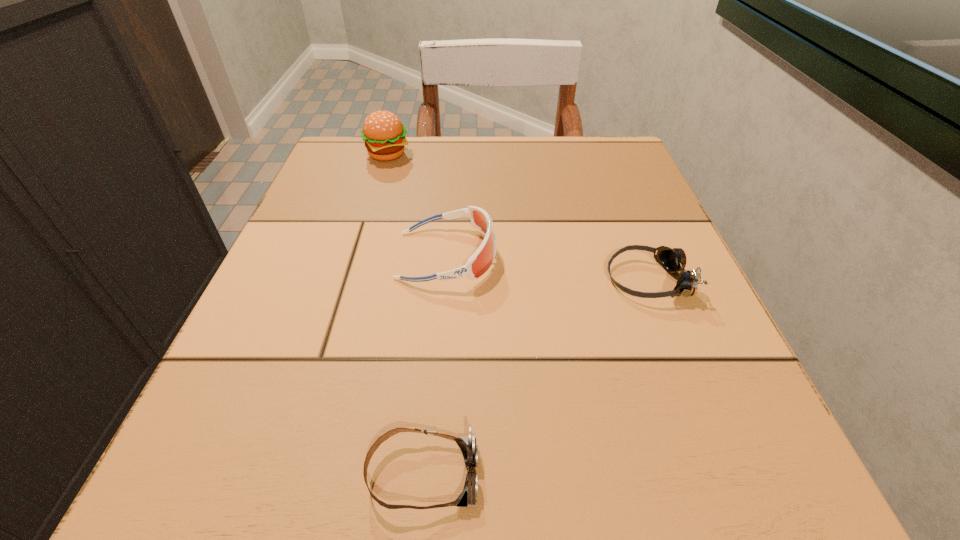
Find the location of `vacant area situated through the lenses of the third tallest object`. vacant area situated through the lenses of the third tallest object is located at coordinates (524, 280).

Find the location of `vacant space situated through the lenses of the third tallest object`. vacant space situated through the lenses of the third tallest object is located at coordinates (435, 280).

The image size is (960, 540). What are the coordinates of `vacant space located 0.220m on the front-facing side of the shortest object` in the screenshot? It's located at (682, 474).

Identify the location of object that is at the far edge. point(384,135).

Where is `object that is at the near edge`? Image resolution: width=960 pixels, height=540 pixels. object that is at the near edge is located at coordinates click(467, 445).

In order to click on object positioned at the left edge in this screenshot , I will do `click(384, 135)`.

This screenshot has width=960, height=540. I want to click on object that is at the right edge, so click(672, 260).

This screenshot has width=960, height=540. In order to click on object present at the far left corner in this screenshot , I will do `click(384, 135)`.

You are a GUI agent. You are given a task and a screenshot of the screen. Output one action in this format:
    pyautogui.click(x=<x>, y=<y>)
    Task: Click on the free space at the far edge
    Image resolution: width=960 pixels, height=540 pixels.
    Given the screenshot: What is the action you would take?
    pyautogui.click(x=401, y=186)

Locate an element on the screen. The width and height of the screenshot is (960, 540). vacant space at the left edge is located at coordinates (302, 288).